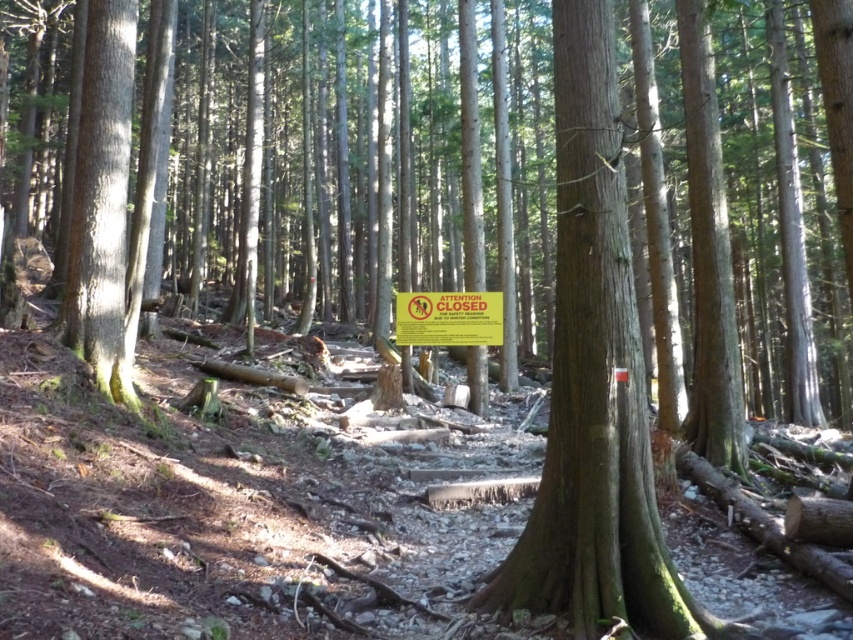
You are a hiker carrying a backpack with a 3.5 meter long tent pole. You need to place the tent pole between the smooth brown tree trunk at center and the yellow paper sign at center. Is there enough space to place the tent pole horizontally between them?

The distance between the smooth brown tree trunk at center and the yellow paper sign at center is 4.13 meters. Since the tent pole is 3.5 meters long, there is enough space to place it horizontally between them.

You are a hiker trying to read the yellow paper sign at center near the smooth brown tree trunk at center. Since the sign is at the same location as the tree trunk, will you have to look up or down to read it?

The smooth brown tree trunk at center is taller than the yellow paper sign at center, so you will have to look down to read the yellow paper sign at center.